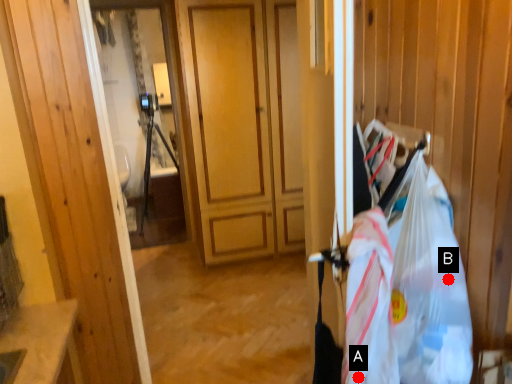
Question: Two points are circled on the image, labeled by A and B beside each circle. Which of the following is the closest to the observer?

Choices:
 (A) A is closer
 (B) B is closer

Answer: (B)